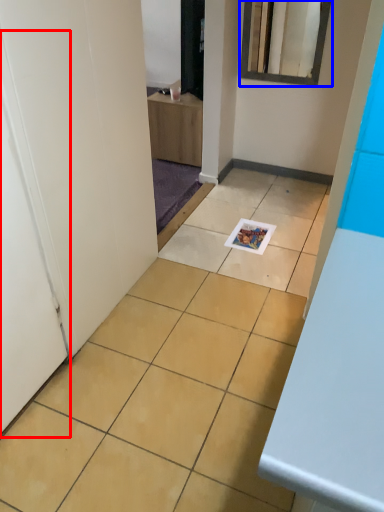
Question: Which object is closer to the camera taking this photo, door (highlighted by a red box) or mirror (highlighted by a blue box)?

Choices:
 (A) door
 (B) mirror

Answer: (A)